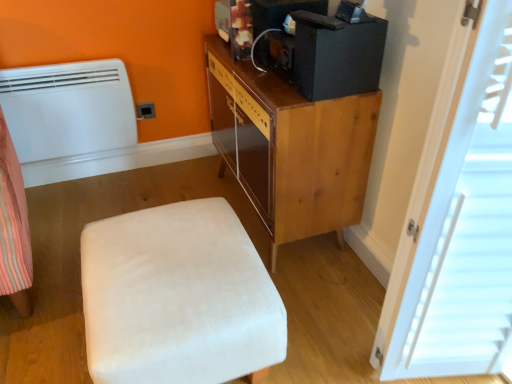
This screenshot has width=512, height=384. I want to click on vacant space that is to the left of white velvety ottoman at lower left, so click(52, 316).